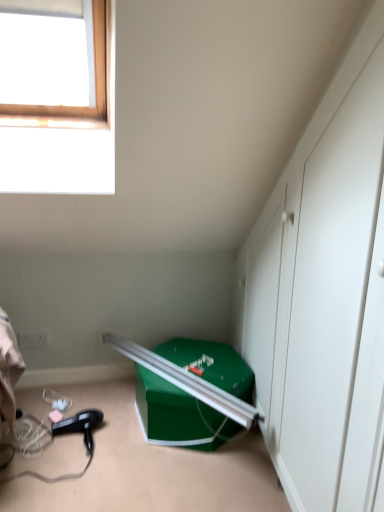
Identify the location of vacant space in black plastic hair dryer at lower left (from a real-world perspective). The width and height of the screenshot is (384, 512). (92, 439).